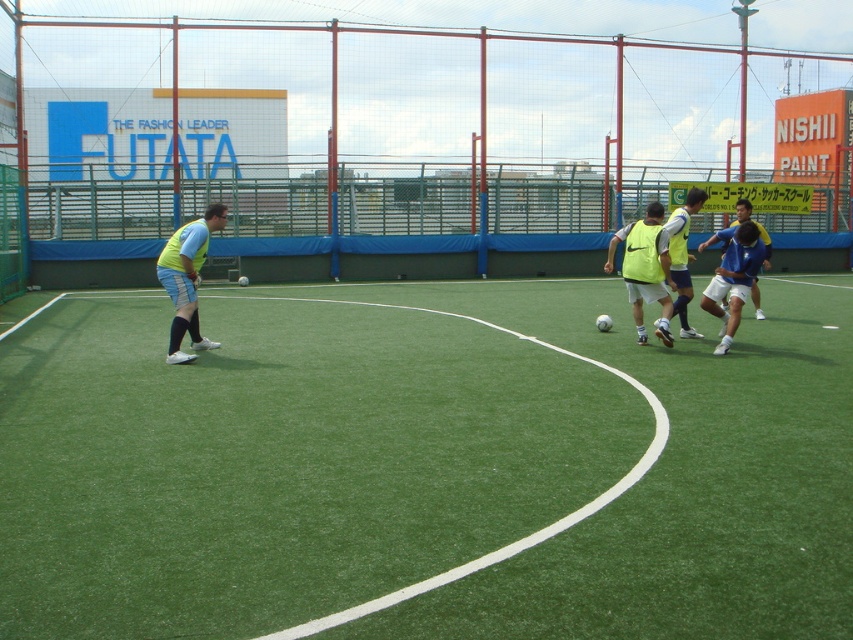
Question: Does green artificial turf at center appear on the left side of matte yellow vest at center?

Choices:
 (A) yes
 (B) no

Answer: (A)

Question: Which is nearer to the matte yellow vest at center?

Choices:
 (A) blue matte soccer ball at center
 (B) green artificial turf at center

Answer: (A)

Question: Among these objects, which one is nearest to the camera?

Choices:
 (A) matte yellow vest at left
 (B) green artificial turf at center
 (C) matte yellow vest at center

Answer: (B)

Question: Is matte yellow vest at center behind blue matte soccer ball at center?

Choices:
 (A) no
 (B) yes

Answer: (B)

Question: Which point is closer to the camera?

Choices:
 (A) (177, 266)
 (B) (654, 216)
 (C) (422, 387)

Answer: (C)

Question: Can you confirm if green artificial turf at center is positioned to the left of matte yellow vest at left?

Choices:
 (A) no
 (B) yes

Answer: (A)